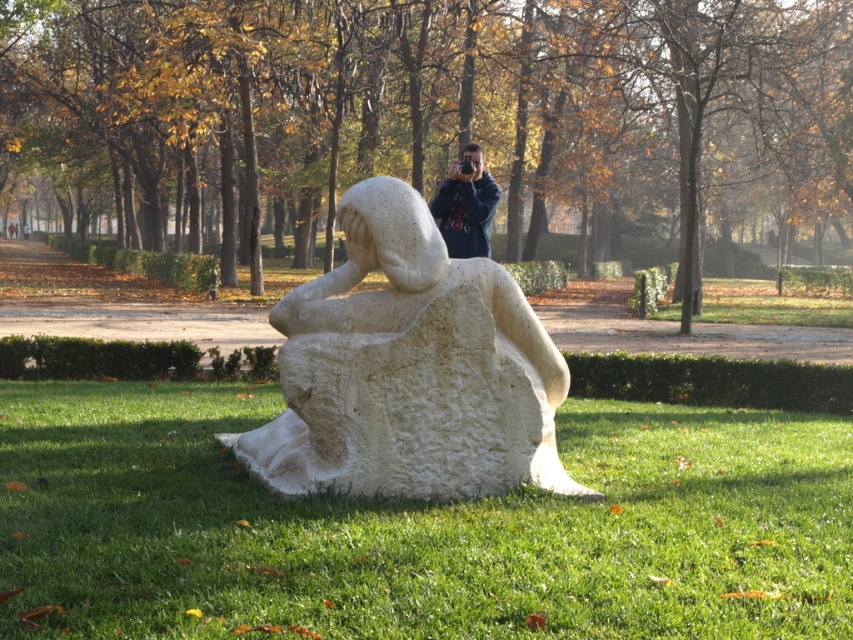
Question: Which of the following is the farthest from the observer?

Choices:
 (A) white stone sculpture at center
 (B) green grass at lower center
 (C) dark blue jacket at center

Answer: (C)

Question: Is white stone sculpture at center further to the viewer compared to dark blue jacket at center?

Choices:
 (A) no
 (B) yes

Answer: (A)

Question: Which of the following is the farthest from the observer?

Choices:
 (A) green grass at lower center
 (B) dark blue jacket at center
 (C) white stone sculpture at center

Answer: (B)

Question: Which is nearer to the green grass at lower center?

Choices:
 (A) white stone sculpture at center
 (B) dark blue jacket at center

Answer: (A)

Question: Is green grass at lower center to the left of dark blue jacket at center from the viewer's perspective?

Choices:
 (A) yes
 (B) no

Answer: (A)

Question: Is green grass at lower center thinner than dark blue jacket at center?

Choices:
 (A) no
 (B) yes

Answer: (A)